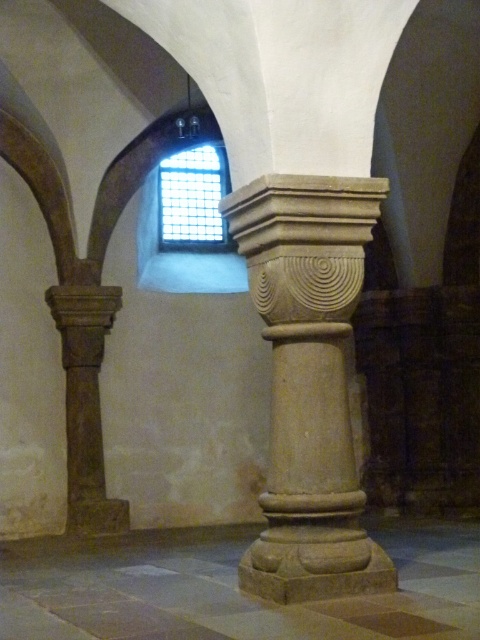
Between beige stone column at center and brown stone column at left, which one is positioned higher?

Positioned higher is beige stone column at center.

Looking at this image, who is more forward, [319,554] or [111,291]?

Point [319,554]

The image size is (480, 640). I want to click on beige stone column at center, so click(x=309, y=381).

Does beige stone column at center have a lesser width compared to smooth stone column at center?

Indeed, beige stone column at center has a lesser width compared to smooth stone column at center.

Is point (273, 566) positioned after point (474, 554)?

No, (273, 566) is closer to viewer.

At what (x,y) coordinates should I click in order to perform the action: click on beige stone column at center. Please return your answer as a coordinate pair (x, y). Image resolution: width=480 pixels, height=640 pixels. Looking at the image, I should click on (309, 381).

Between point (463, 584) and point (204, 147), which one is positioned behind?

Positioned behind is point (204, 147).

From the picture: Between smooth stone column at center and clear glass window at upper center, which one has more height?

clear glass window at upper center

Between point (32, 630) and point (206, 177), which one is positioned behind?

The point (206, 177) is behind.

Locate an element on the screen. This screenshot has width=480, height=640. smooth stone column at center is located at coordinates (229, 588).